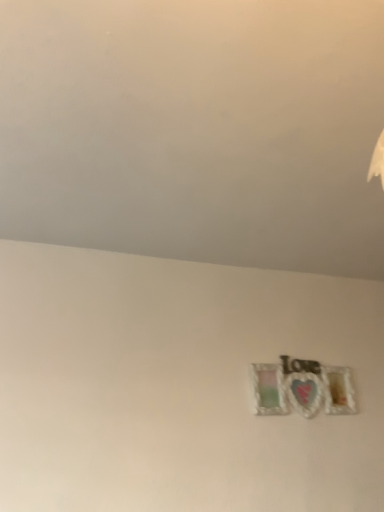
This screenshot has height=512, width=384. What do you see at coordinates (302, 388) in the screenshot?
I see `metallic silver picture frame at center` at bounding box center [302, 388].

At what (x,y) coordinates should I click in order to perform the action: click on metallic silver picture frame at center. Please return your answer as a coordinate pair (x, y). The height and width of the screenshot is (512, 384). Looking at the image, I should click on pyautogui.click(x=302, y=388).

Locate an element on the screen. The image size is (384, 512). metallic silver picture frame at center is located at coordinates (302, 388).